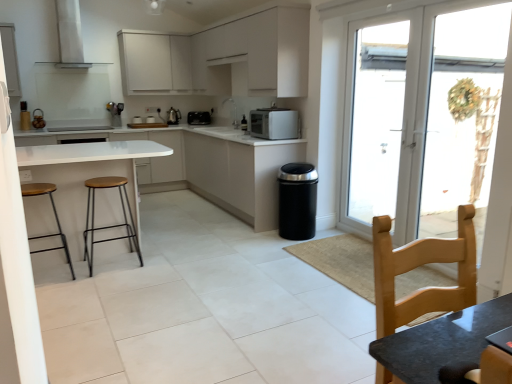
Locate an element on the screen. vacant space in front of white glossy table at center is located at coordinates (x=117, y=296).